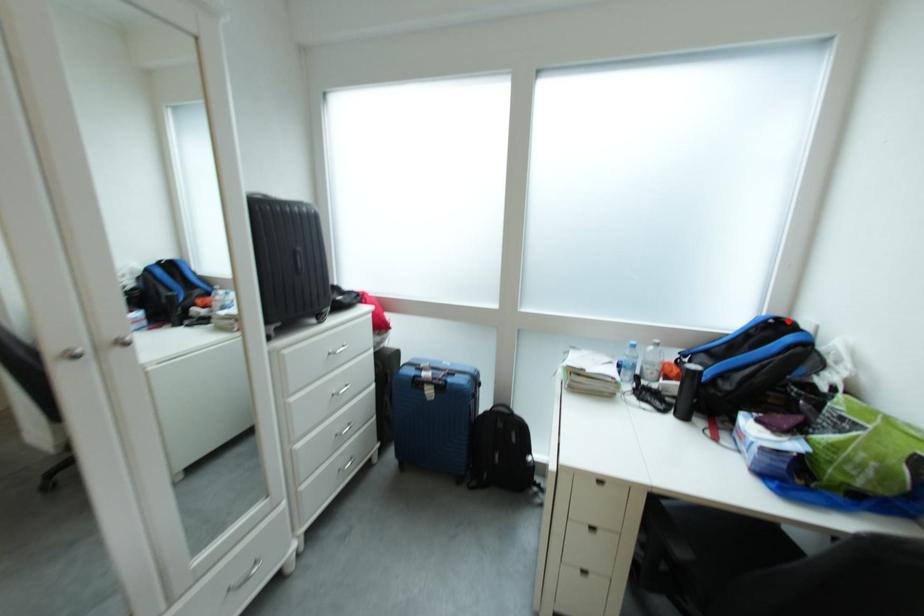
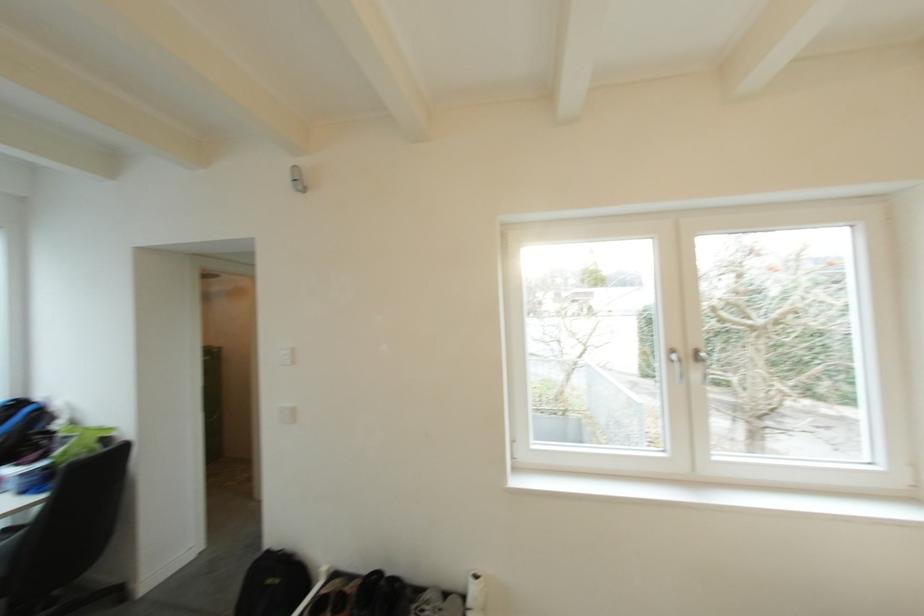
The point at the highlighted location is marked in the first image. Where is the corresponding point in the second image?

(29, 403)